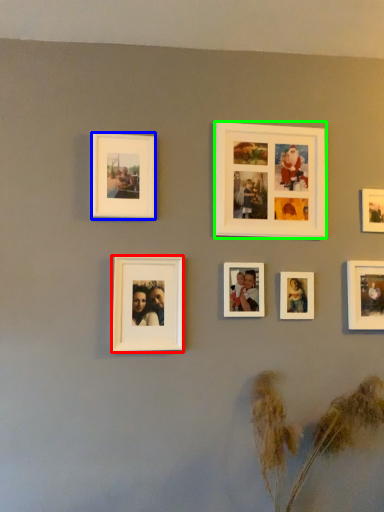
Question: Considering the real-world distances, which object is closest to picture frame (highlighted by a red box)? picture frame (highlighted by a blue box) or picture frame (highlighted by a green box).

Choices:
 (A) picture frame
 (B) picture frame

Answer: (A)